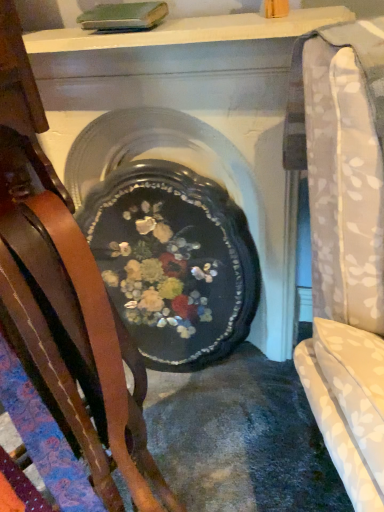
Question: Is wooden chair at left outside of black glossy tray at center?

Choices:
 (A) yes
 (B) no

Answer: (A)

Question: Does wooden chair at left have a greater height compared to black glossy tray at center?

Choices:
 (A) no
 (B) yes

Answer: (B)

Question: Is wooden chair at left positioned with its back to black glossy tray at center?

Choices:
 (A) no
 (B) yes

Answer: (A)

Question: Does wooden chair at left contain black glossy tray at center?

Choices:
 (A) yes
 (B) no

Answer: (B)

Question: Is wooden chair at left oriented towards black glossy tray at center?

Choices:
 (A) no
 (B) yes

Answer: (A)

Question: From the image's perspective, does wooden chair at left appear lower than black glossy tray at center?

Choices:
 (A) yes
 (B) no

Answer: (A)

Question: Can you confirm if black glossy tray at center is shorter than wooden chair at left?

Choices:
 (A) yes
 (B) no

Answer: (A)

Question: From the image's perspective, is black glossy tray at center located beneath wooden chair at left?

Choices:
 (A) yes
 (B) no

Answer: (B)

Question: Considering the relative positions of black glossy tray at center and wooden chair at left in the image provided, is black glossy tray at center to the right of wooden chair at left from the viewer's perspective?

Choices:
 (A) no
 (B) yes

Answer: (B)

Question: Can you confirm if black glossy tray at center is thinner than wooden chair at left?

Choices:
 (A) no
 (B) yes

Answer: (A)

Question: Is black glossy tray at center next to wooden chair at left?

Choices:
 (A) yes
 (B) no

Answer: (B)

Question: Is black glossy tray at center surrounding wooden chair at left?

Choices:
 (A) no
 (B) yes

Answer: (A)

Question: Considering the positions of black glossy tray at center and wooden chair at left in the image, is black glossy tray at center bigger or smaller than wooden chair at left?

Choices:
 (A) big
 (B) small

Answer: (A)